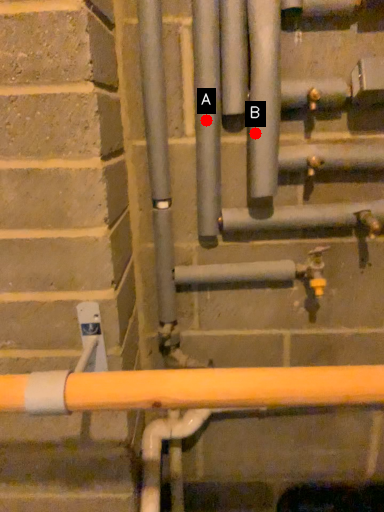
Question: Two points are circled on the image, labeled by A and B beside each circle. Which of the following is the closest to the observer?

Choices:
 (A) A is closer
 (B) B is closer

Answer: (B)